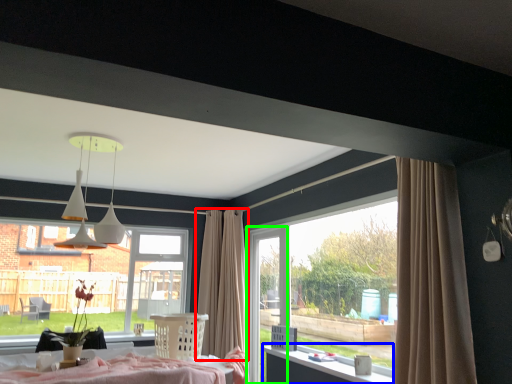
Question: Which object is positioned closest to curtain (highlighted by a red box)? Select from table (highlighted by a blue box) and screen door (highlighted by a green box).

Choices:
 (A) table
 (B) screen door

Answer: (B)